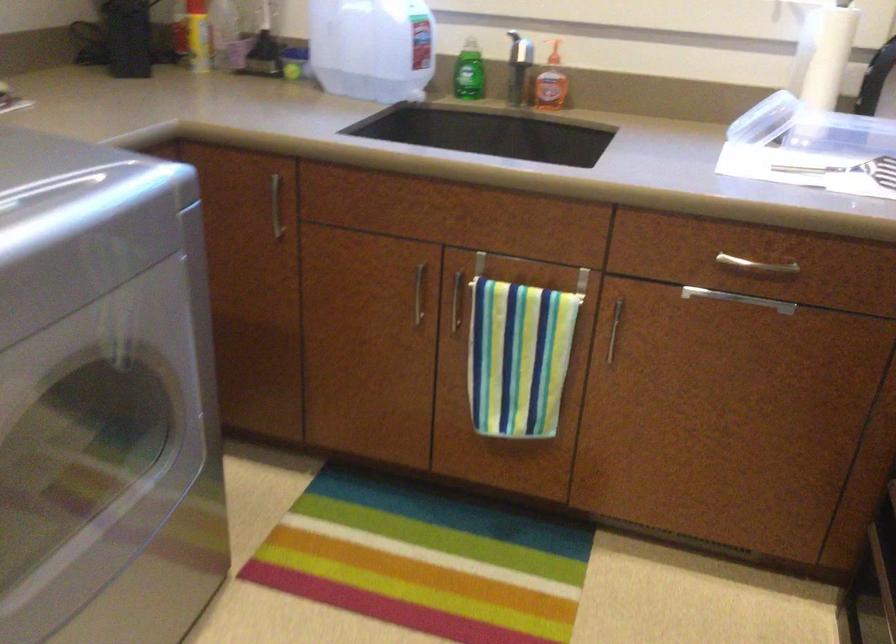
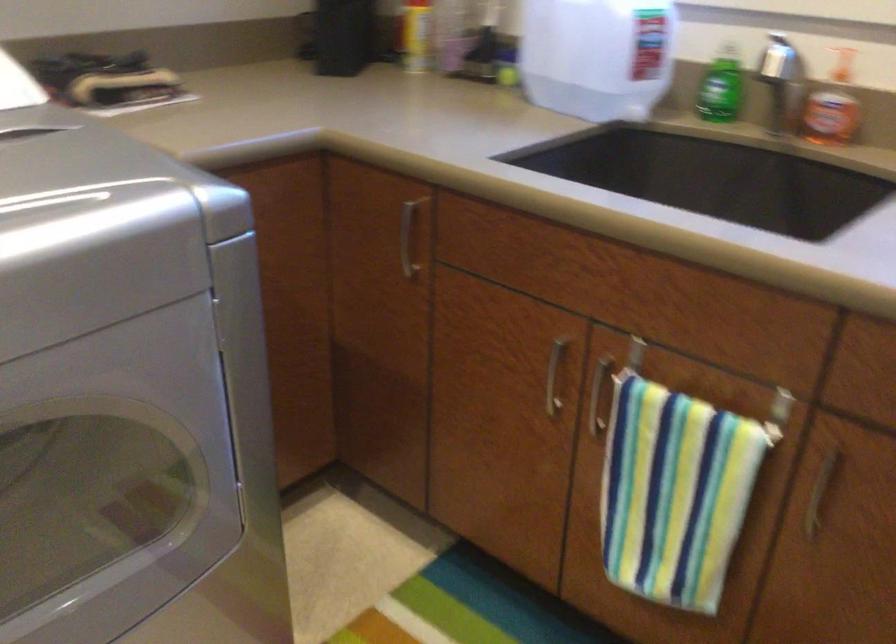
In the second image, find the point that corresponds to point (553, 80) in the first image.

(832, 106)